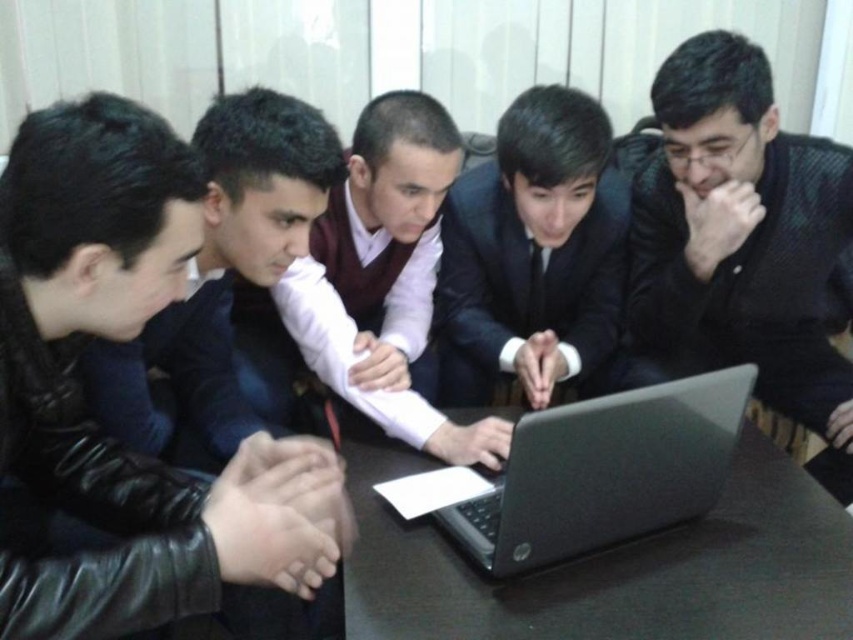
You are a photographer trying to capture a group photo of the five individuals around the table. You notice the black textured shirt at center and the black leather business suit at lower left. Considering their heights, which person should you position closer to the front to ensure everyone is visible in the photo?

The black leather business suit at lower left should be positioned closer to the front since the black textured shirt at center is much taller, allowing the shorter individual to be seen without being blocked by the taller person.

You are standing at the entrance of the room and want to reach the black leather business suit at lower left. Which direction should you move towards to get closer to it?

The black leather business suit at lower left is located at point 0.787 on the x axis and 0.107 on the y axis. Since you are at the entrance, you should move towards the lower left direction to reach it.